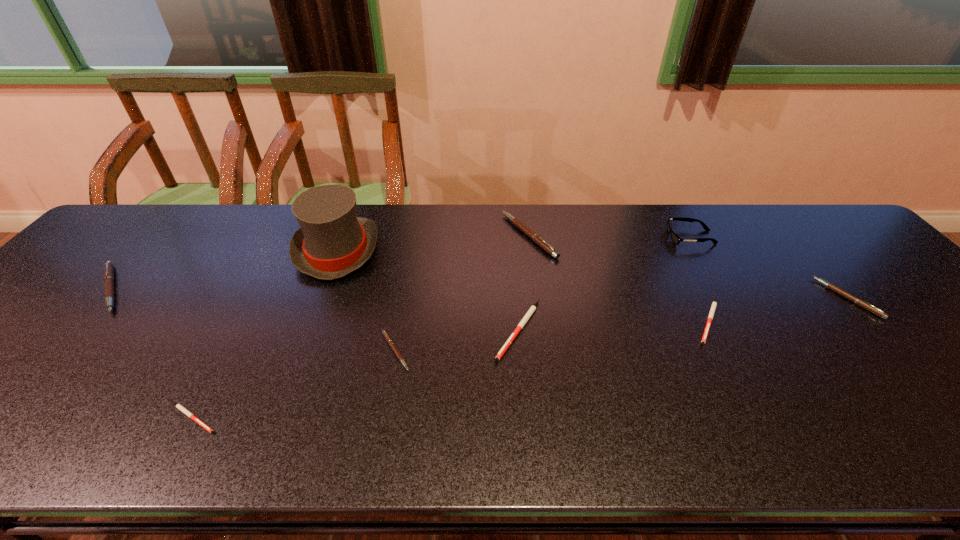
Where is `white pen object that ranks as the second closest to the sixth pen from left to right`? This screenshot has width=960, height=540. white pen object that ranks as the second closest to the sixth pen from left to right is located at coordinates (181, 408).

This screenshot has height=540, width=960. Find the location of `vacant space that satisfies the following two spatial constraints: 1. on the clicker of the second pen from right to left; 2. on the clicker of the smallest white pen`. vacant space that satisfies the following two spatial constraints: 1. on the clicker of the second pen from right to left; 2. on the clicker of the smallest white pen is located at coordinates (759, 418).

Where is `free spot that satisfies the following two spatial constraints: 1. on the front-facing side of the black sunglasses; 2. on the clicker of the rightmost white pen`? free spot that satisfies the following two spatial constraints: 1. on the front-facing side of the black sunglasses; 2. on the clicker of the rightmost white pen is located at coordinates (740, 321).

Find the location of a particular element. The width and height of the screenshot is (960, 540). free location that satisfies the following two spatial constraints: 1. on the clicker of the second white pen from left to right; 2. on the clicker of the nearest object is located at coordinates (526, 418).

Identify the location of blank area in the image that satisfies the following two spatial constraints: 1. at the nib of the seventh shortest object; 2. on the clicker of the second white pen from left to right. The height and width of the screenshot is (540, 960). (542, 330).